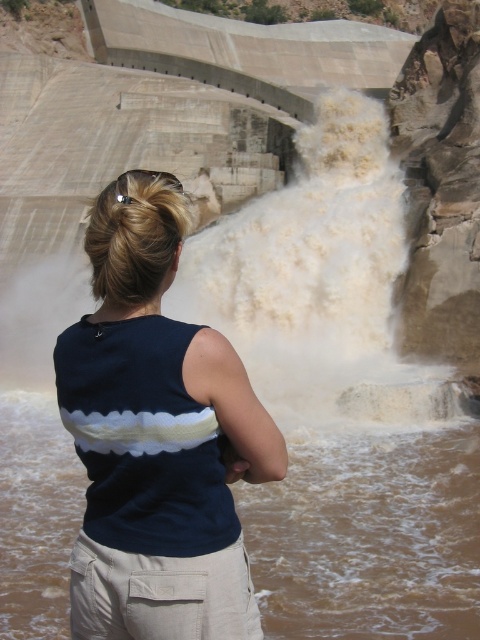
Question: Which of the following is the closest to the observer?

Choices:
 (A) [x=69, y=516]
 (B) [x=377, y=202]

Answer: (A)

Question: Which object appears farthest from the camera in this image?

Choices:
 (A) navy blue fabric shirt at center
 (B) brown muddy water at lower center
 (C) white frothy water at center

Answer: (C)

Question: Is brown muddy water at lower center positioned at the back of white frothy water at center?

Choices:
 (A) yes
 (B) no

Answer: (B)

Question: Which point appears farthest from the camera in this image?

Choices:
 (A) (212, 628)
 (B) (347, 604)
 (C) (215, 228)

Answer: (C)

Question: Is navy blue fabric shirt at center further to camera compared to white frothy water at center?

Choices:
 (A) yes
 (B) no

Answer: (B)

Question: From the image, what is the correct spatial relationship of navy blue fabric shirt at center in relation to brown muddy water at lower center?

Choices:
 (A) left
 (B) right

Answer: (A)